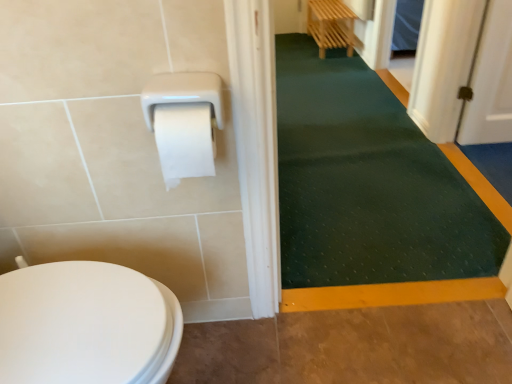
Measure the distance between dark green rubber bath mat at center and camera.

4.51 feet.

In order to face dark green rubber bath mat at center, should I rotate leftwards or rightwards?

You should rotate right by 9.815 degrees.

What is the approximate height of dark green rubber bath mat at center?

dark green rubber bath mat at center is 1.39 inches in height.

Where is `dark green rubber bath mat at center`? The height and width of the screenshot is (384, 512). dark green rubber bath mat at center is located at coordinates (367, 183).

The image size is (512, 384). Describe the element at coordinates (367, 183) in the screenshot. I see `dark green rubber bath mat at center` at that location.

This screenshot has height=384, width=512. What do you see at coordinates (354, 346) in the screenshot?
I see `brown textured floor at lower right` at bounding box center [354, 346].

At what (x,y) coordinates should I click in order to perform the action: click on brown textured floor at lower right. Please return your answer as a coordinate pair (x, y). Looking at the image, I should click on (354, 346).

You are a GUI agent. You are given a task and a screenshot of the screen. Output one action in this format:
    pyautogui.click(x=<x>, y=<y>)
    Task: Click on the dark green rubber bath mat at center
    
    Given the screenshot: What is the action you would take?
    pyautogui.click(x=367, y=183)

Based on their positions, is brown textured floor at lower right located to the left or right of dark green rubber bath mat at center?

Clearly, brown textured floor at lower right is on the left of dark green rubber bath mat at center in the image.

In the scene shown: Is brown textured floor at lower right further to camera compared to dark green rubber bath mat at center?

No, brown textured floor at lower right is in front of dark green rubber bath mat at center.

Is point (493, 324) behind point (294, 281)?

No, (493, 324) is closer to viewer.

From the image's perspective, which one is positioned lower, brown textured floor at lower right or dark green rubber bath mat at center?

brown textured floor at lower right is shown below in the image.

From a real-world perspective, is brown textured floor at lower right located beneath dark green rubber bath mat at center?

Correct, in the physical world, brown textured floor at lower right is lower than dark green rubber bath mat at center.

Which of these two, brown textured floor at lower right or dark green rubber bath mat at center, is thinner?

With smaller width is brown textured floor at lower right.

Which of these two, brown textured floor at lower right or dark green rubber bath mat at center, stands shorter?

brown textured floor at lower right is shorter.

Which of these two, brown textured floor at lower right or dark green rubber bath mat at center, is smaller?

brown textured floor at lower right is smaller.

Do you think brown textured floor at lower right is within dark green rubber bath mat at center, or outside of it?

The correct answer is: outside.

Are brown textured floor at lower right and dark green rubber bath mat at center making contact?

brown textured floor at lower right and dark green rubber bath mat at center are clearly separated.

Is brown textured floor at lower right oriented towards dark green rubber bath mat at center?

Yes, brown textured floor at lower right is facing dark green rubber bath mat at center.

Locate an element on the screen. path lying on the left of dark green rubber bath mat at center is located at coordinates (354, 346).

Between dark green rubber bath mat at center and brown textured floor at lower right, which one appears on the right side from the viewer's perspective?

dark green rubber bath mat at center.

Which is behind, dark green rubber bath mat at center or brown textured floor at lower right?

dark green rubber bath mat at center.

Which point is more forward, [452,273] or [334,321]?

The point [334,321] is more forward.

From the image's perspective, is dark green rubber bath mat at center beneath brown textured floor at lower right?

No.

From a real-world perspective, which is physically below, dark green rubber bath mat at center or brown textured floor at lower right?

brown textured floor at lower right is physically lower.

Considering the sizes of objects dark green rubber bath mat at center and brown textured floor at lower right in the image provided, who is thinner, dark green rubber bath mat at center or brown textured floor at lower right?

Thinner between the two is brown textured floor at lower right.

Which of these two, dark green rubber bath mat at center or brown textured floor at lower right, stands shorter?

Standing shorter between the two is brown textured floor at lower right.

Which of these two, dark green rubber bath mat at center or brown textured floor at lower right, is smaller?

With smaller size is brown textured floor at lower right.

Consider the image. Is brown textured floor at lower right completely or partially inside dark green rubber bath mat at center?

Answer: No, brown textured floor at lower right is not a part of dark green rubber bath mat at center.

Is dark green rubber bath mat at center not near brown textured floor at lower right?

dark green rubber bath mat at center is near brown textured floor at lower right, not far away.

Does dark green rubber bath mat at center turn towards brown textured floor at lower right?

Yes, dark green rubber bath mat at center is oriented towards brown textured floor at lower right.

What's the angular difference between dark green rubber bath mat at center and brown textured floor at lower right's facing directions?

The facing directions of dark green rubber bath mat at center and brown textured floor at lower right are 180 degrees apart.

Measure the distance between dark green rubber bath mat at center and brown textured floor at lower right.

dark green rubber bath mat at center and brown textured floor at lower right are 22.91 inches apart.

Where is `path below the dark green rubber bath mat at center (from the image's perspective)`? This screenshot has width=512, height=384. path below the dark green rubber bath mat at center (from the image's perspective) is located at coordinates (354, 346).

Locate an element on the screen. The image size is (512, 384). path that appears below the dark green rubber bath mat at center (from a real-world perspective) is located at coordinates (354, 346).

Locate an element on the screen. Image resolution: width=512 pixels, height=384 pixels. path below the dark green rubber bath mat at center (from the image's perspective) is located at coordinates (354, 346).